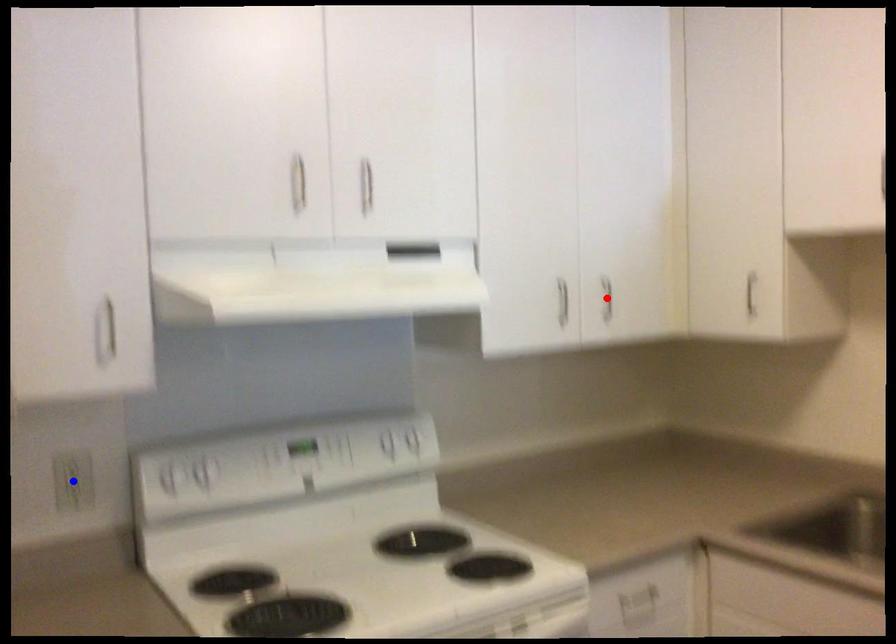
Question: Two points are marked on the image. Which point is closer to the camera?

Choices:
 (A) Blue point is closer.
 (B) Red point is closer.

Answer: (A)